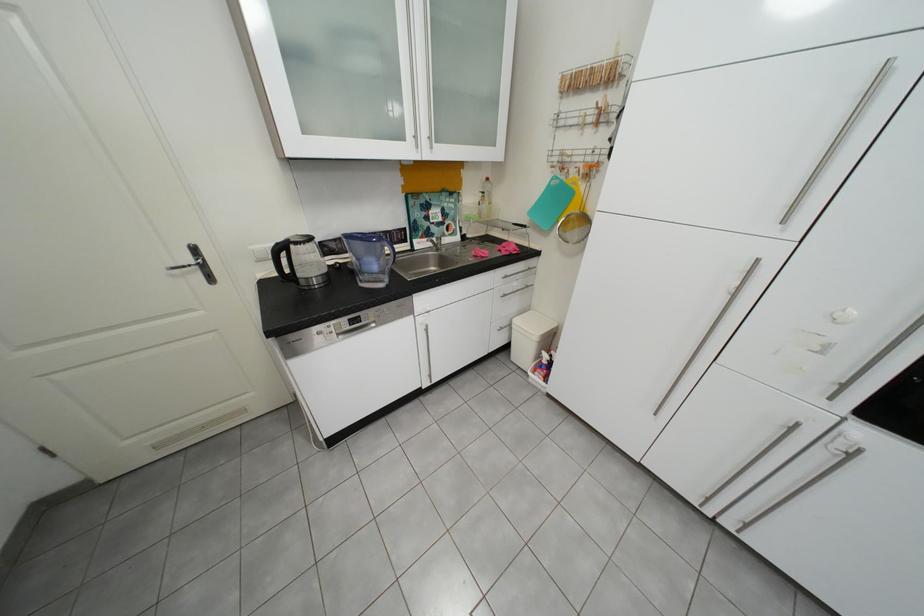
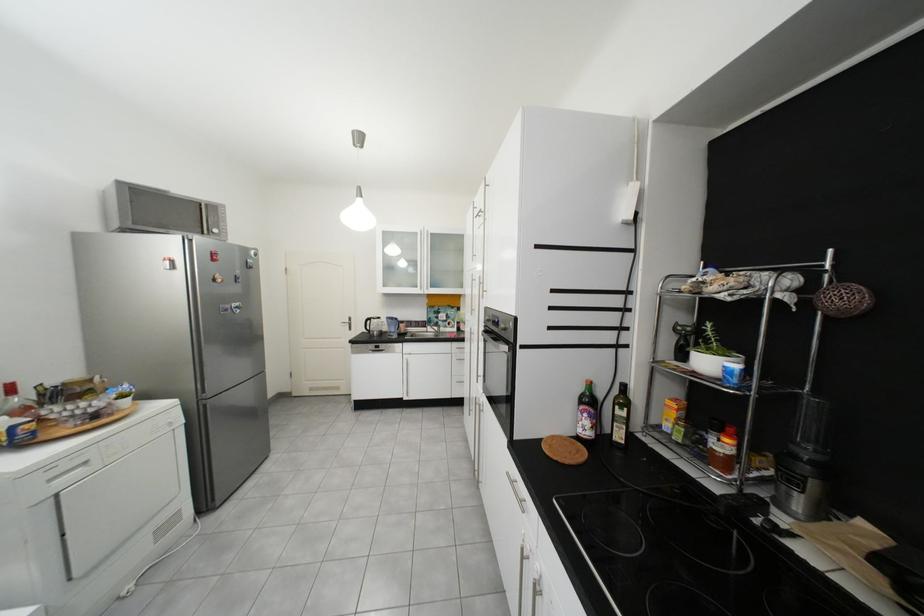
In the second image, find the point that corresponds to the point at 295,248 in the first image.

(381, 321)